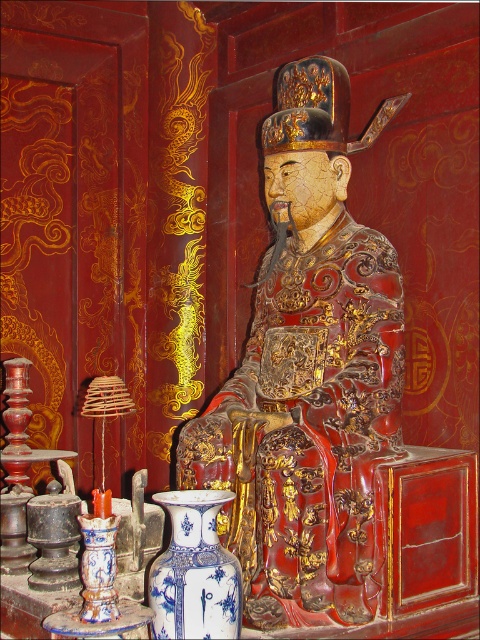
You are an interior designer planning to place a new decorative item in the scene. You have two points marked as potential locations for placement. The first point is at coordinate point(328, 496) and the second is at point(175, 627). Which point is closer to the viewer?

Point(175, 627) is closer to the viewer because it is in front of point(328, 496) according to their spatial relationship.

You are an interior designer planning to place a new shelf in this room. The shelf must be tall enough to accommodate both the glossy wood statue at center and the blue porcelain vase at center. Based on their sizes, what is the minimum height the shelf should have?

The glossy wood statue at center is taller than the blue porcelain vase at center. Therefore, the shelf must be at least as tall as the glossy wood statue at center to accommodate both items.

You are a visitor standing in front of the statue and want to take a photo of the glossy wood statue at center without getting too close. If your camera can focus on objects up to 2 meters away, will you be able to capture a clear photo?

The glossy wood statue at center is 1.97 meters away from viewer, so yes, the camera can focus on it clearly since the distance is within the 2 meters range.